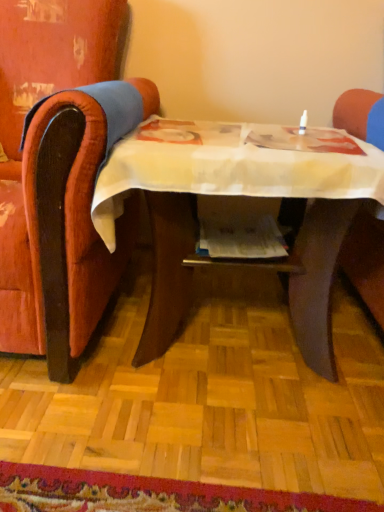
Question: Is velvet-like red armchair at left taller than printed paper magazine at center?

Choices:
 (A) yes
 (B) no

Answer: (A)

Question: Is velvet-like red armchair at left thinner than printed paper magazine at center?

Choices:
 (A) yes
 (B) no

Answer: (B)

Question: From the image's perspective, does velvet-like red armchair at left appear higher than printed paper magazine at center?

Choices:
 (A) no
 (B) yes

Answer: (B)

Question: Is velvet-like red armchair at left further to camera compared to printed paper magazine at center?

Choices:
 (A) yes
 (B) no

Answer: (B)

Question: Is velvet-like red armchair at left aimed at printed paper magazine at center?

Choices:
 (A) no
 (B) yes

Answer: (A)

Question: Can you confirm if velvet-like red armchair at left is wider than printed paper magazine at center?

Choices:
 (A) no
 (B) yes

Answer: (B)

Question: Is wooden table at center outside of printed paper magazine at center?

Choices:
 (A) yes
 (B) no

Answer: (A)

Question: Is printed paper magazine at center completely or partially inside wooden table at center?

Choices:
 (A) no
 (B) yes

Answer: (B)

Question: From the image's perspective, is wooden table at center beneath printed paper magazine at center?

Choices:
 (A) no
 (B) yes

Answer: (B)

Question: Are wooden table at center and printed paper magazine at center located far from each other?

Choices:
 (A) yes
 (B) no

Answer: (B)

Question: Is wooden table at center positioned in front of printed paper magazine at center?

Choices:
 (A) yes
 (B) no

Answer: (A)

Question: Is wooden table at center facing towards printed paper magazine at center?

Choices:
 (A) yes
 (B) no

Answer: (A)

Question: From the image's perspective, is printed paper magazine at center on top of wooden table at center?

Choices:
 (A) no
 (B) yes

Answer: (B)